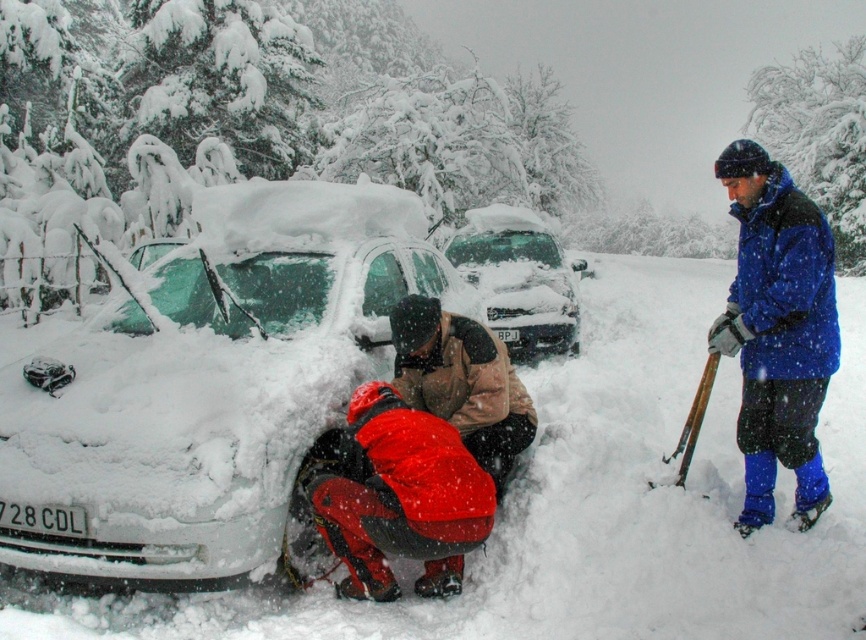
You are a delivery driver who needs to ensure your vehicle is clear of snow before starting your route. You see the white matte car at center and the blue fleece jacket at right in the scene. Which object requires immediate attention to ensure safe driving conditions?

The white matte car at center requires immediate attention because it is larger in size than the blue fleece jacket at right, indicating it is the vehicle needing snow removal for safe driving.

You are standing at point A which is at coordinates point (192, 554) and want to walk to point B at coordinates point (837, 288). Which direction should you move relative to the scene?

Since point (192, 554) is in front of point (837, 288), you should move backward to reach point B from point A.